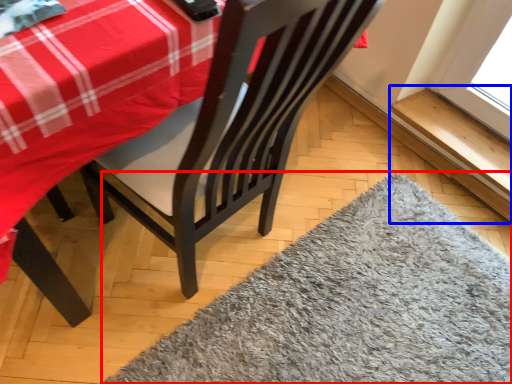
Question: Which object appears farthest to the camera in this image, mat (highlighted by a red box) or window sill (highlighted by a blue box)?

Choices:
 (A) mat
 (B) window sill

Answer: (B)